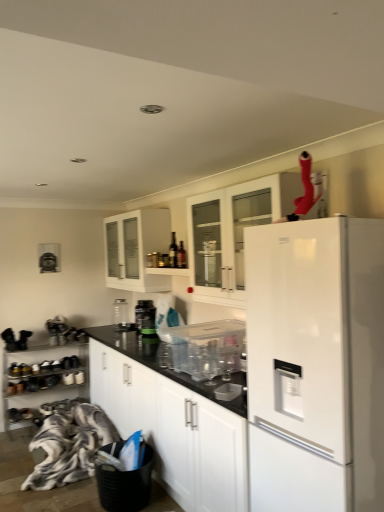
Question: Is white matte refrigerator at right in front of or behind transparent plastic container at center, arranged as the first appliance when viewed from the front, in the image?

Choices:
 (A) front
 (B) behind

Answer: (A)

Question: From a real-world perspective, relative to transparent plastic container at center, positioned as the third appliance in left-to-right order, is white matte refrigerator at right vertically above or below?

Choices:
 (A) below
 (B) above

Answer: (A)

Question: Estimate the real-world distances between objects in this image. Which object is farther from the fluffy fabric blanket at lower left?

Choices:
 (A) white matte refrigerator at right
 (B) dark brown glass wine bottle at upper center
 (C) white matte cabinet at center, the 3th cabinetry from the top
 (D) clear glass jar at center, which is the 1th appliance in left-to-right order
 (E) white glass cabinet at upper center, the 4th cabinetry ordered from the bottom

Answer: (A)

Question: Based on their relative distances, which object is farther from the clear glass jar at center, acting as the third appliance starting from the right?

Choices:
 (A) transparent plastic container at center, positioned as the third appliance in left-to-right order
 (B) white matte cabinet at center, arranged as the 2th cabinetry when ordered from the bottom
 (C) metallic silver shoe rack at lower left, the 1th cabinetry when ordered from bottom to top
 (D) green matte jar at center, the 2th appliance when ordered from back to front
 (E) white glass cabinet at upper center, the 4th cabinetry ordered from the bottom

Answer: (E)